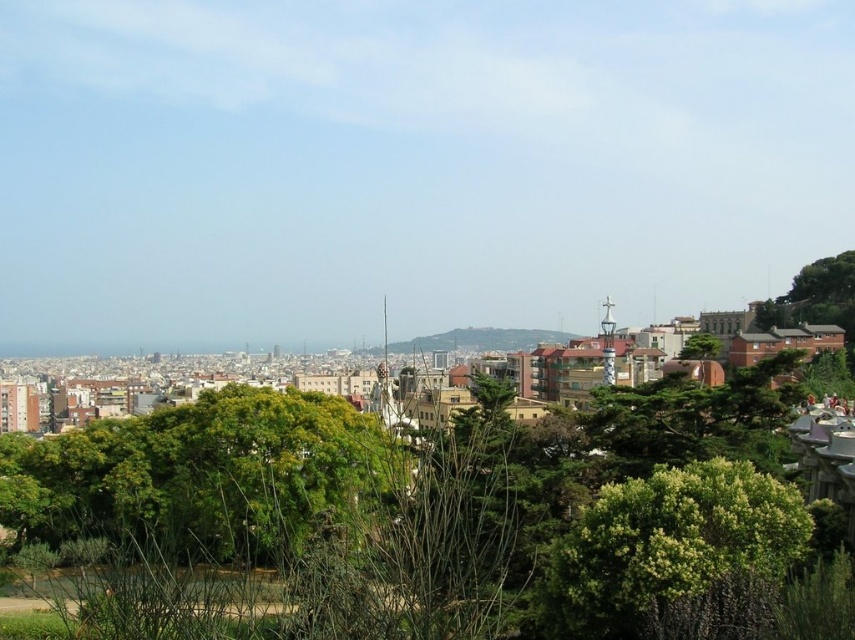
Is green leafy tree at center shorter than green leafy bush at center-right?

No, green leafy tree at center is not shorter than green leafy bush at center-right.

Who is more forward, (3,484) or (546,566)?

Positioned in front is point (546,566).

Where is `green leafy tree at center`? This screenshot has height=640, width=855. green leafy tree at center is located at coordinates (199, 474).

Can you confirm if green leafy bush at center-right is positioned below green leafy tree at upper right?

Correct, green leafy bush at center-right is located below green leafy tree at upper right.

Between point (685, 628) and point (685, 346), which one is positioned in front?

Positioned in front is point (685, 628).

You are a GUI agent. You are given a task and a screenshot of the screen. Output one action in this format:
    pyautogui.click(x=<x>, y=<y>)
    Task: Click on the green leafy bush at center-right
    
    Given the screenshot: What is the action you would take?
    pyautogui.click(x=675, y=556)

Looking at this image, can you confirm if green grassy hillside at center is shorter than green leafy tree at upper right?

In fact, green grassy hillside at center may be taller than green leafy tree at upper right.

Describe the element at coordinates (481, 339) in the screenshot. The width and height of the screenshot is (855, 640). I see `green grassy hillside at center` at that location.

Which is in front, point (466, 340) or point (699, 346)?

Point (699, 346) is in front.

Find the location of a particular element. This screenshot has height=640, width=855. green grassy hillside at center is located at coordinates (481, 339).